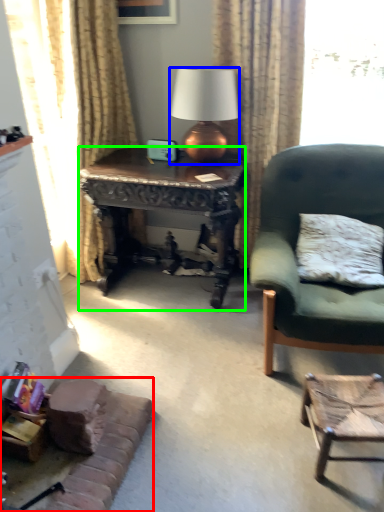
Question: Based on their relative distances, which object is farther from couch (highlighted by a red box)? Choose from lamp (highlighted by a blue box) and desk (highlighted by a green box).

Choices:
 (A) lamp
 (B) desk

Answer: (A)